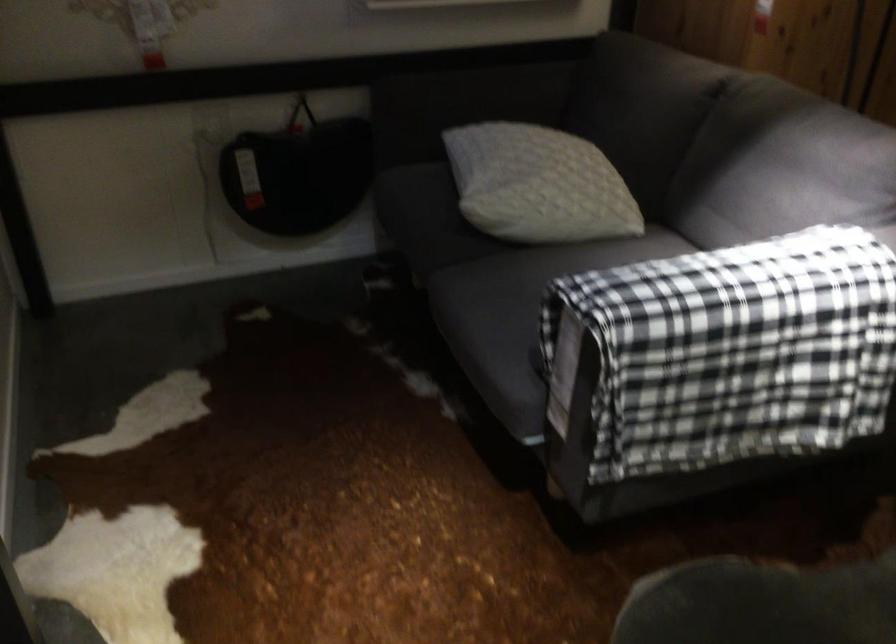
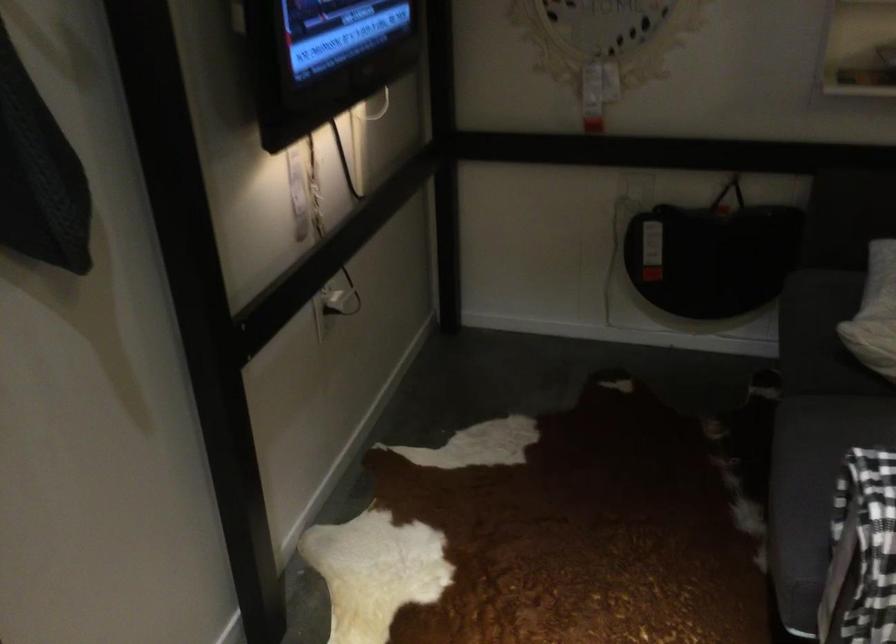
Where in the second image is the point corresponding to (x=476, y=193) from the first image?

(874, 313)